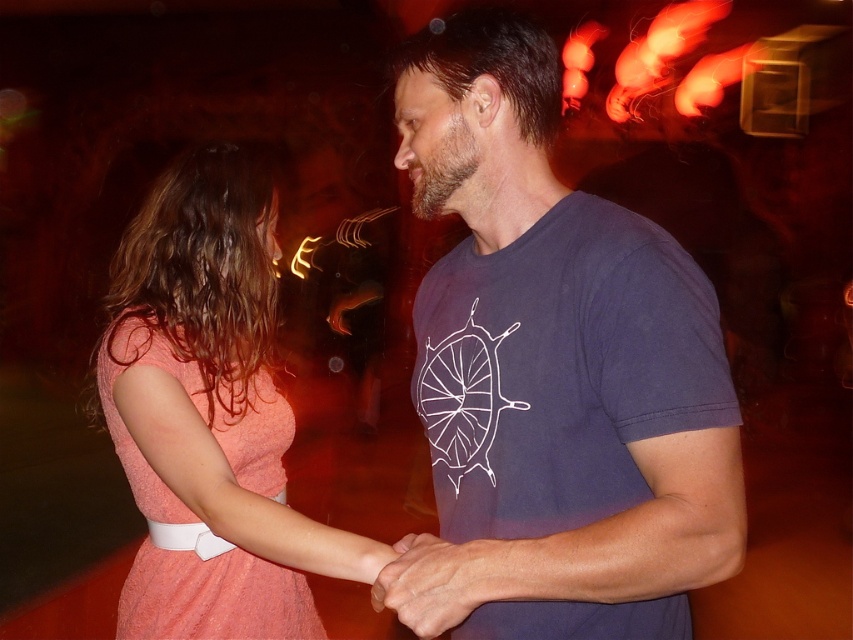
You are a photographer at a party and need to position two guests wearing the matte coral dress at center and the coral fabric dress at left for a group photo. Given their dress widths, which guest should stand closer to the camera to ensure both fit in the frame without overlapping?

The matte coral dress at center is wider than the coral fabric dress at left, so the guest wearing the coral fabric dress at left should stand closer to the camera to accommodate the wider dress in the frame.